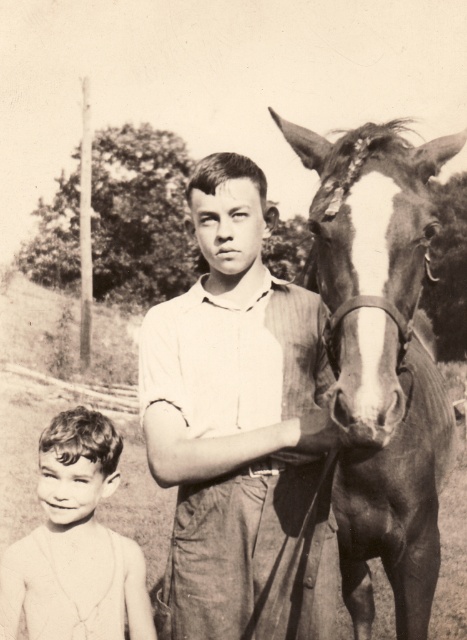
You are a photographer trying to capture the scene. You notice the white striped shirt at center and the dark brown leather horse at right. Based on their positions, which one is higher up in the image?

The white striped shirt at center is above the dark brown leather horse at right, so the white striped shirt at center is higher up in the image.

You are a photographer trying to capture a group photo of the white striped shirt at center and the smooth skin boy at lower left. Since you want both subjects to be clearly visible in the photo, would you need to adjust their positions to ensure neither is blocked?

The white striped shirt at center is in front of the smooth skin boy at lower left, so part of the smooth skin boy at lower left may be obscured. To ensure both are fully visible, you should ask the white striped shirt at center to move slightly backward or to the side.